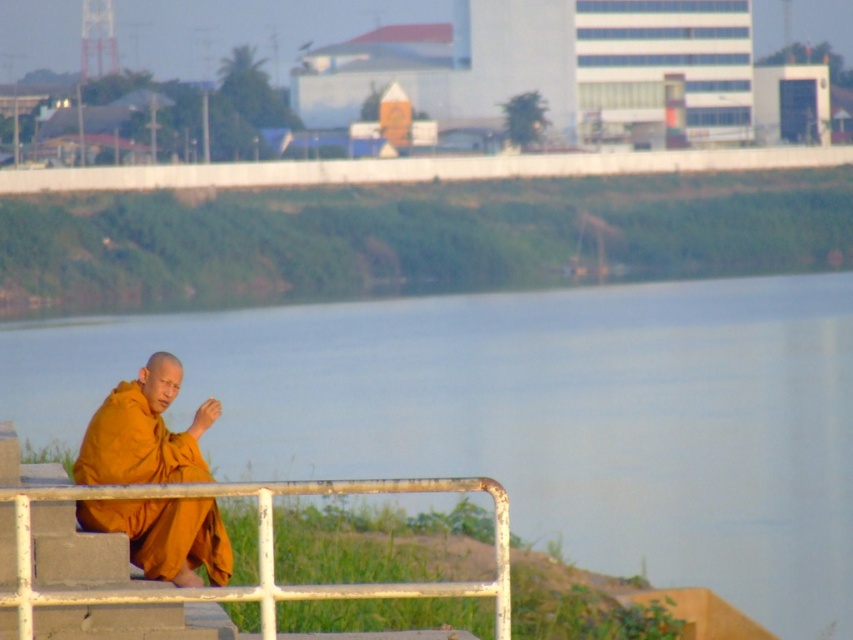
You are a visitor standing on the concrete step where the monk is sitting. You want to take a photo of the blue water at center without including the white metal rail at lower center in the frame. Is it possible to do so based on their positions?

The blue water at center is located above the white metal rail at lower center, so yes, it is possible to take a photo of the blue water at center without including the white metal rail at lower center by angling the camera upwards to focus on the higher positioned water area.

You are a photographer trying to capture the matte orange robe at lower left in your shot. The camera you are using has a rectangular viewfinder with a 0.5x0.5 aspect ratio. Can the point marked by point (143, 433) be included in the viewfinder without moving the camera?

The point (143, 433) marks the matte orange robe at lower left, so yes, the point can be included in the viewfinder as long as the camera is positioned to frame the robe within the 0.5x0.5 aspect ratio.